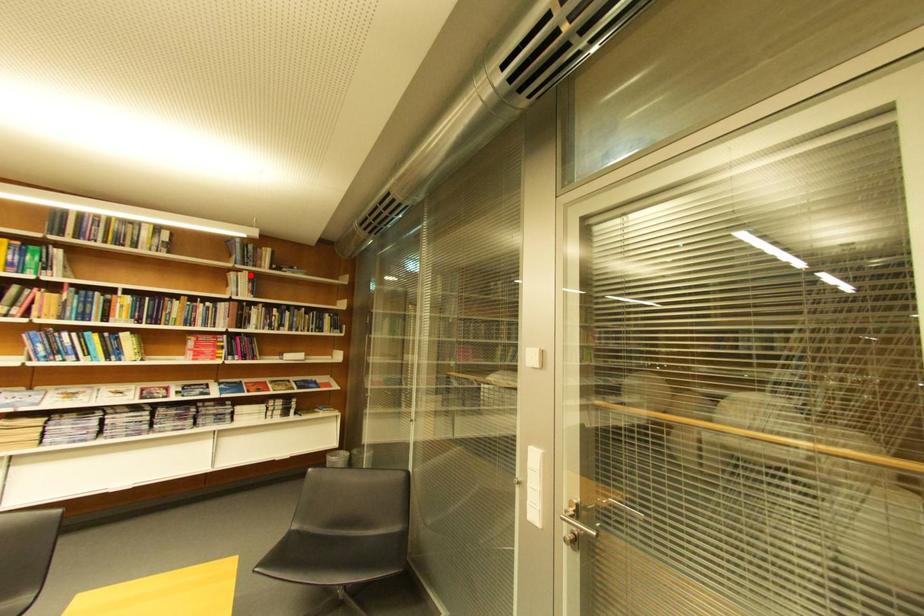
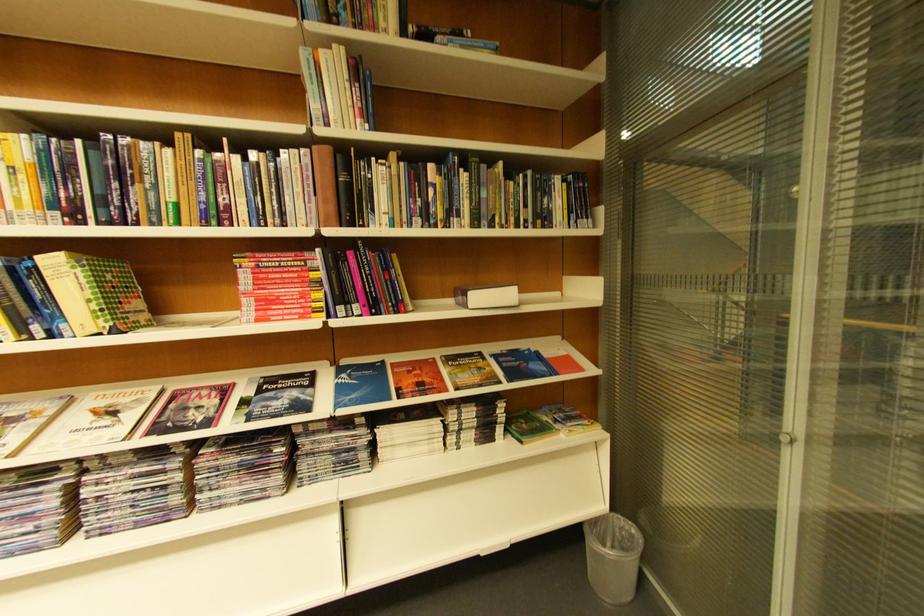
Question: I am providing you with two images of the same scene from different viewpoints. A red point is marked on the first image. Can you still see the location of the red point in image 2?

Choices:
 (A) Yes
 (B) No

Answer: (A)